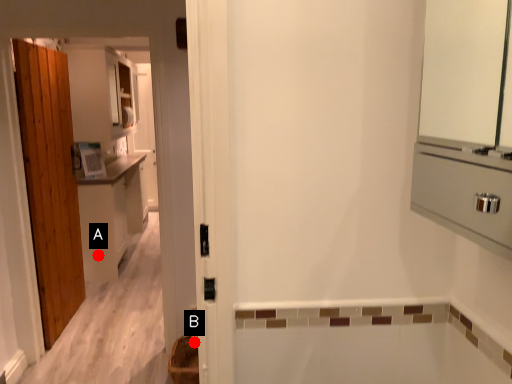
Question: Two points are circled on the image, labeled by A and B beside each circle. Among these points, which one is nearest to the camera?

Choices:
 (A) A is closer
 (B) B is closer

Answer: (B)